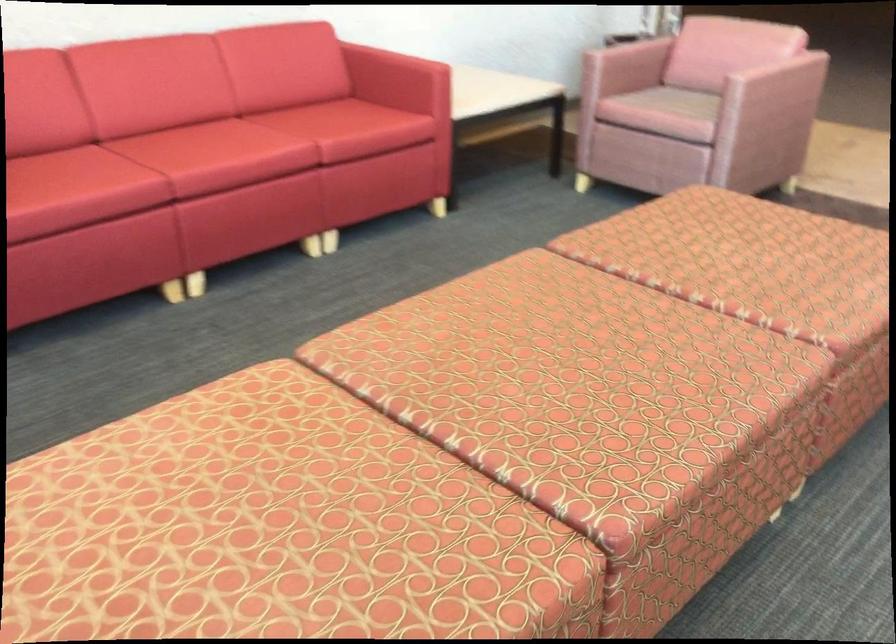
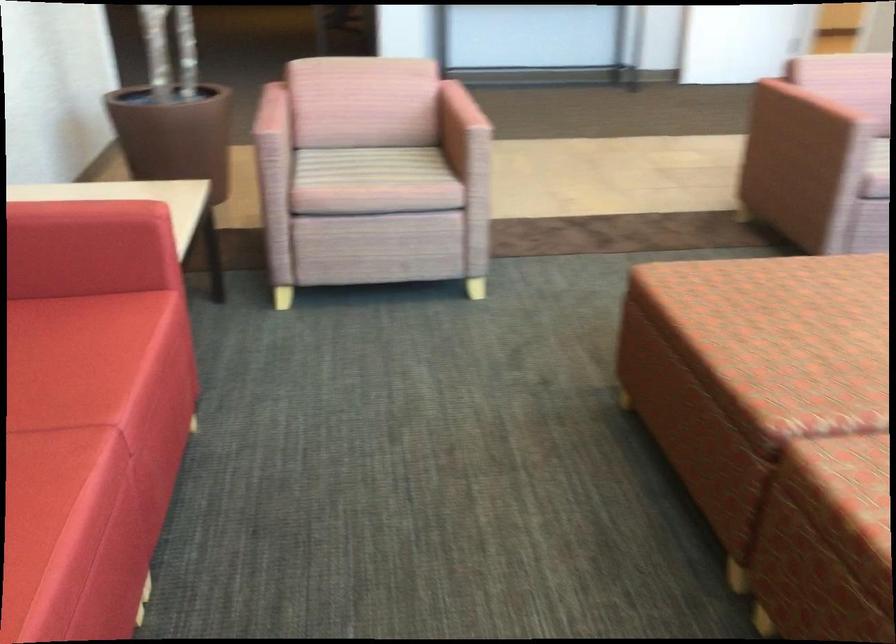
Where in the second image is the point corresponding to point 346,117 from the first image?

(69, 360)